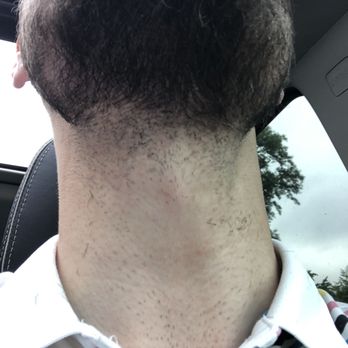
At what (x,y) coordinates should I click in order to perform the action: click on black headrest of seat. Please return your answer as a coordinate pair (x, y). Image resolution: width=348 pixels, height=348 pixels. Looking at the image, I should click on (45, 205).